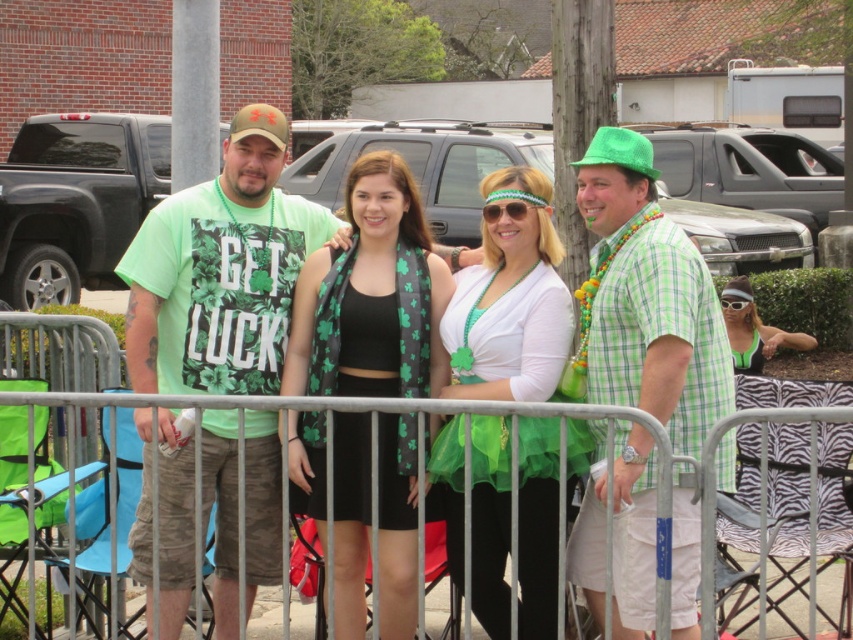
Question: Does green plaid shirt at center have a smaller size compared to shiny green tulle skirt at center?

Choices:
 (A) yes
 (B) no

Answer: (B)

Question: Which of the following is the farthest from the observer?

Choices:
 (A) (553, 332)
 (B) (193, 308)
 (C) (631, 589)

Answer: (B)

Question: Where is black matte scarf at center located in relation to green fabric bikini top at right in the image?

Choices:
 (A) below
 (B) above

Answer: (A)

Question: Which of the following is the farthest from the observer?

Choices:
 (A) (532, 593)
 (B) (683, 384)

Answer: (A)

Question: Considering the real-world distances, which object is closest to the green fabric bikini top at right?

Choices:
 (A) shiny green tulle skirt at center
 (B) black matte scarf at center
 (C) green plaid shirt at center
 (D) metallic silver fence at center

Answer: (D)

Question: Can you confirm if metallic silver fence at center is wider than green fabric bikini top at right?

Choices:
 (A) no
 (B) yes

Answer: (A)